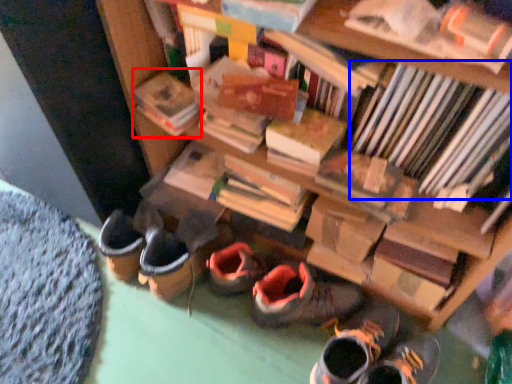
Question: Which of the following is the closest to the observer, paperback book (highlighted by a red box) or book (highlighted by a blue box)?

Choices:
 (A) paperback book
 (B) book

Answer: (B)